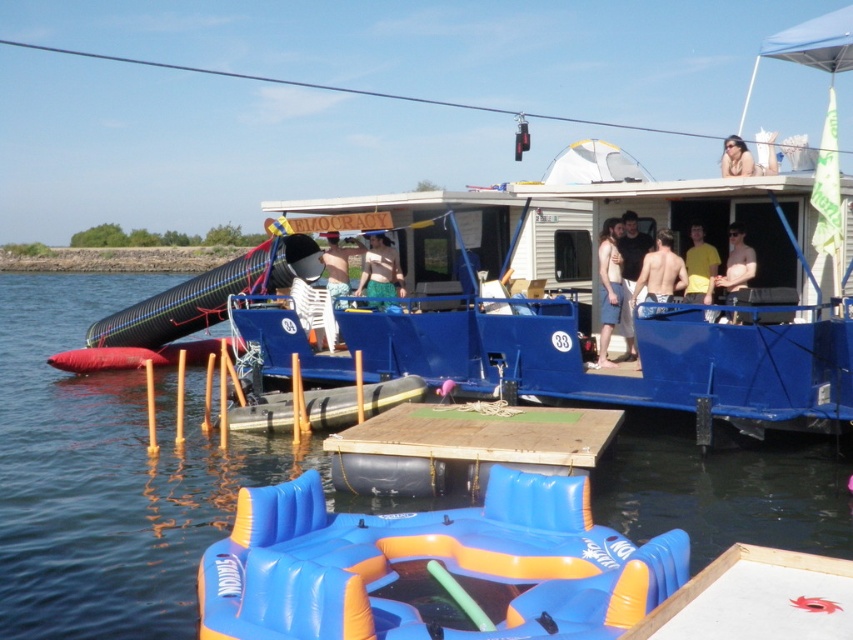
Question: Does blue inflatable raft at lower center have a smaller size compared to matte black bikini top at upper right?

Choices:
 (A) no
 (B) yes

Answer: (B)

Question: Which of the following is the closest to the observer?

Choices:
 (A) (538, 465)
 (B) (350, 241)
 (C) (724, 161)
 (D) (618, 316)

Answer: (A)

Question: Does wooden platform at center appear on the right side of beige fabric shorts at center?

Choices:
 (A) yes
 (B) no

Answer: (B)

Question: Which object appears closest to the camera in this image?

Choices:
 (A) skinny man at center
 (B) yellow matte shirt at center

Answer: (B)

Question: Considering the relative positions of blue inflatable raft at center and skinny man at center in the image provided, where is blue inflatable raft at center located with respect to skinny man at center?

Choices:
 (A) left
 (B) right

Answer: (A)

Question: Which is farther from the blue inflatable raft at center?

Choices:
 (A) blue inflatable raft at lower center
 (B) skinny man at center

Answer: (B)